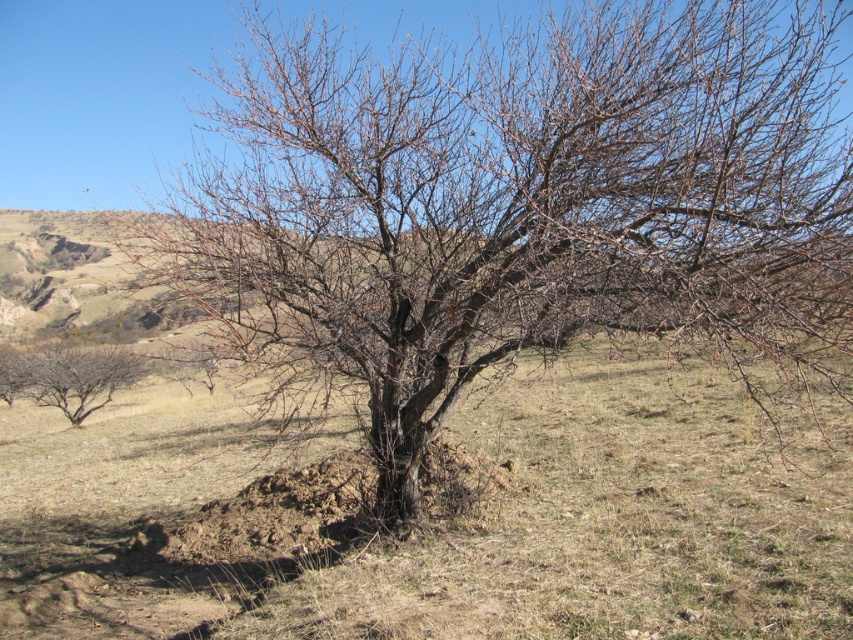
Measure the distance from bare branches at left to bare branches at lower left.

bare branches at left and bare branches at lower left are 3.88 meters apart from each other.

Is point (71, 385) closer to viewer compared to point (1, 364)?

Yes, point (71, 385) is closer to viewer.

The width and height of the screenshot is (853, 640). Identify the location of bare branches at left. (68, 376).